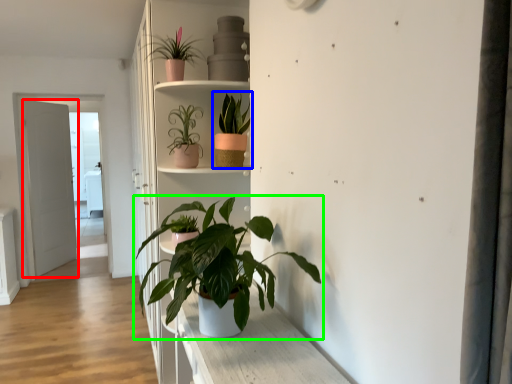
Question: Which object is positioned closest to door (highlighted by a red box)? Select from houseplant (highlighted by a blue box) and houseplant (highlighted by a green box).

Choices:
 (A) houseplant
 (B) houseplant

Answer: (A)